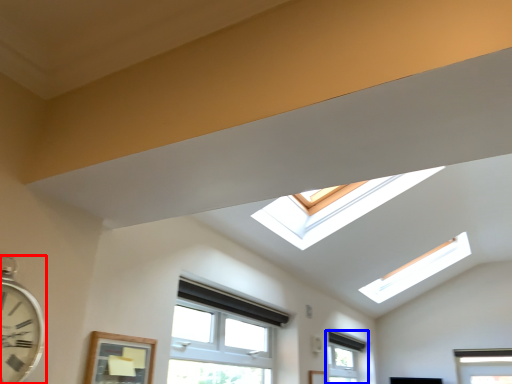
Question: Among these objects, which one is nearest to the camera, clock (highlighted by a red box) or window (highlighted by a blue box)?

Choices:
 (A) clock
 (B) window

Answer: (A)